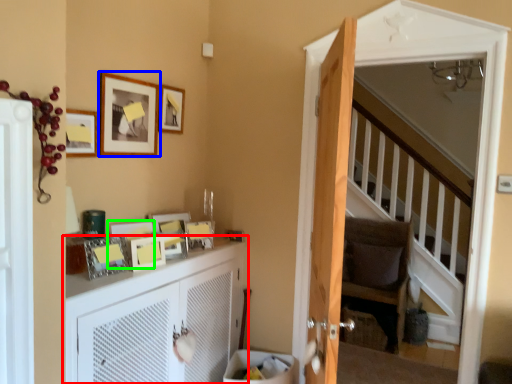
Question: Which object is the farthest from cabinetry (highlighted by a red box)? Choose among these: picture frame (highlighted by a blue box) or picture frame (highlighted by a green box).

Choices:
 (A) picture frame
 (B) picture frame

Answer: (A)